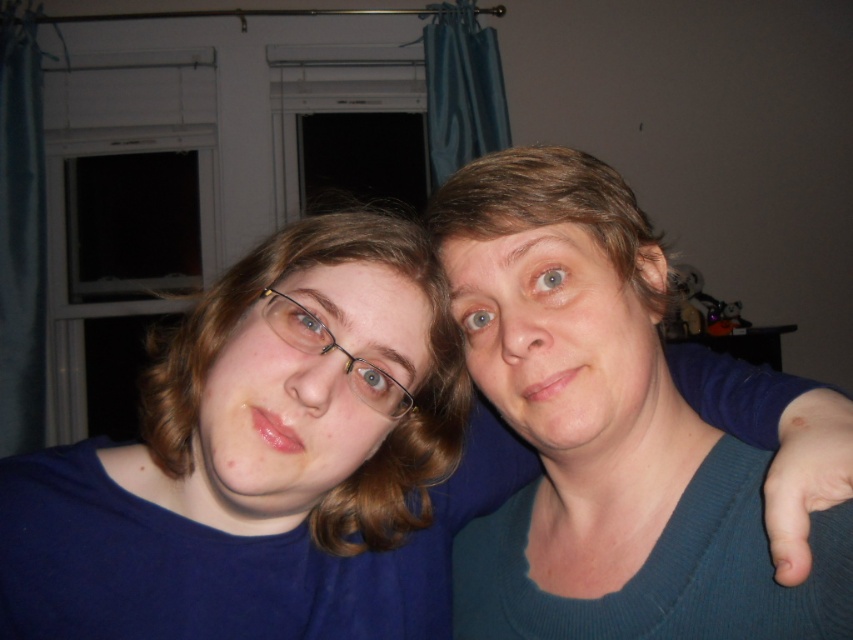
Question: Which object is closer to the camera taking this photo?

Choices:
 (A) matte blue sweater at center
 (B) teal sweater at center
 (C) matte plastic glasses at center
 (D) clear plastic glasses at center

Answer: (B)

Question: Is matte blue shirt at center thinner than matte plastic glasses at center?

Choices:
 (A) no
 (B) yes

Answer: (B)

Question: Which object appears farthest from the camera in this image?

Choices:
 (A) teal sweater at center
 (B) matte blue sweater at center

Answer: (B)

Question: Can you confirm if matte blue sweater at center is positioned above matte plastic glasses at center?

Choices:
 (A) yes
 (B) no

Answer: (B)

Question: Is teal sweater at center bigger than matte plastic glasses at center?

Choices:
 (A) yes
 (B) no

Answer: (A)

Question: Which object is the farthest from the matte blue shirt at center?

Choices:
 (A) clear plastic glasses at center
 (B) teal sweater at center
 (C) matte plastic glasses at center
 (D) matte blue sweater at center

Answer: (D)